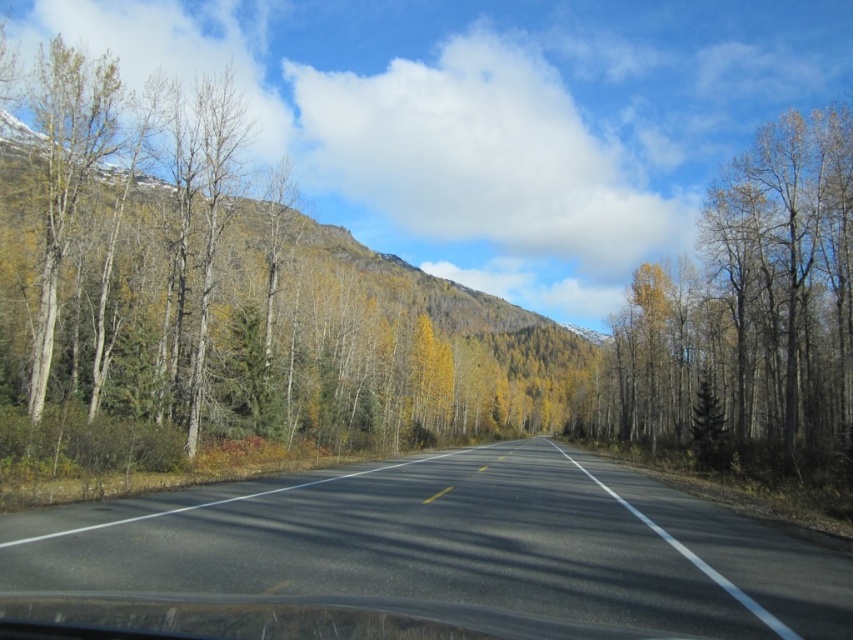
Is point (718, 541) farther from viewer compared to point (660, 371)?

No, it is in front of (660, 371).

The width and height of the screenshot is (853, 640). I want to click on black asphalt road at center, so click(x=426, y=557).

At what (x,y) coordinates should I click in order to perform the action: click on black asphalt road at center. Please return your answer as a coordinate pair (x, y). The width and height of the screenshot is (853, 640). Looking at the image, I should click on (426, 557).